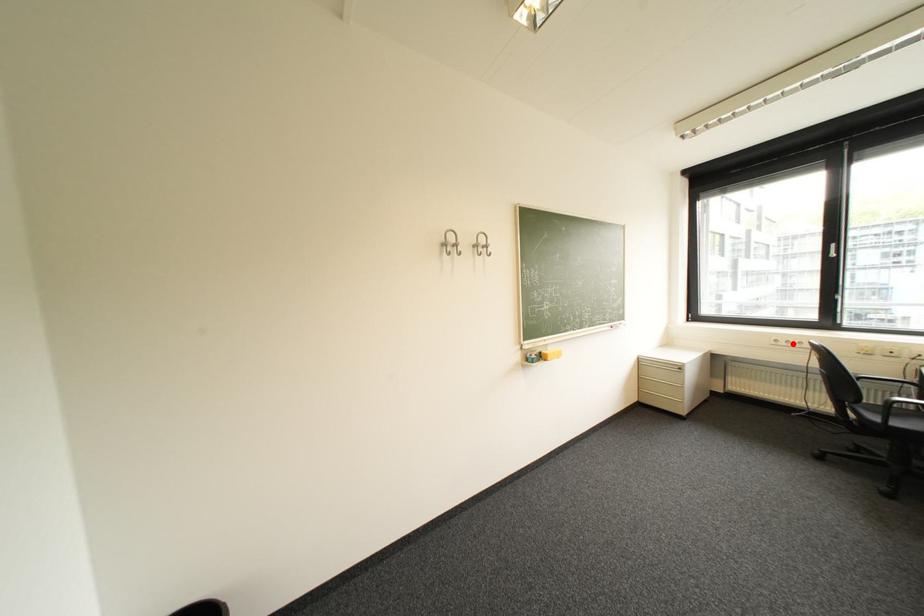
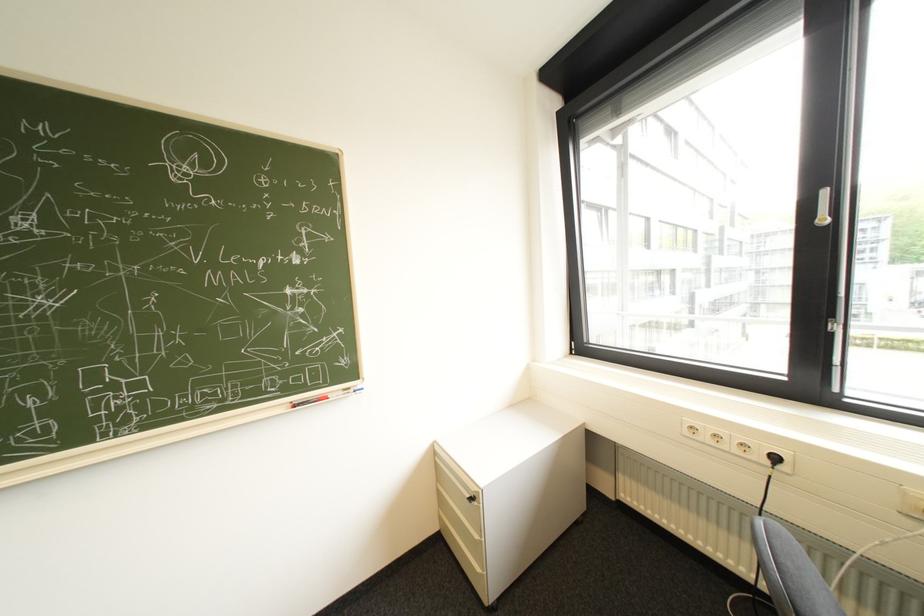
Find the pixel in the second image that matches the highlighted location in the first image.

(715, 438)